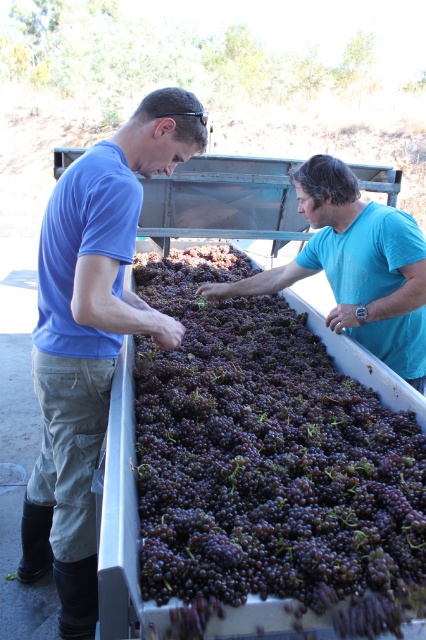
Question: Is the position of purple matte grapes at center less distant than that of blue cotton shirt at center?

Choices:
 (A) yes
 (B) no

Answer: (A)

Question: Estimate the real-world distances between objects in this image. Which object is closer to the blue cotton shirt at center?

Choices:
 (A) blue cotton shirt at left
 (B) purple matte grapes at center

Answer: (B)

Question: Based on their relative distances, which object is farther from the blue cotton shirt at center?

Choices:
 (A) blue cotton shirt at left
 (B) purple matte grapes at center

Answer: (A)

Question: Does blue cotton shirt at left have a lesser width compared to blue cotton shirt at center?

Choices:
 (A) no
 (B) yes

Answer: (B)

Question: Is purple matte grapes at center positioned before blue cotton shirt at left?

Choices:
 (A) no
 (B) yes

Answer: (B)

Question: Which point is farther from the camera taking this photo?

Choices:
 (A) (77, 195)
 (B) (259, 582)
 (C) (328, 266)

Answer: (C)